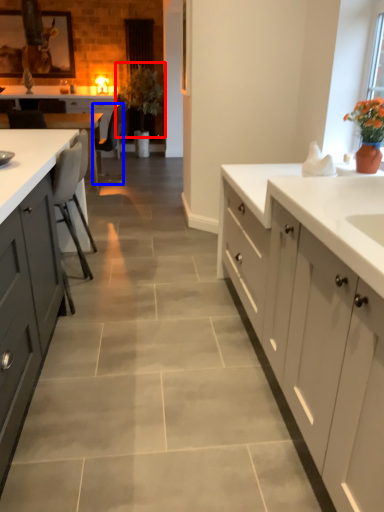
Question: Which object is further to the camera taking this photo, plant (highlighted by a red box) or chair (highlighted by a blue box)?

Choices:
 (A) plant
 (B) chair

Answer: (A)